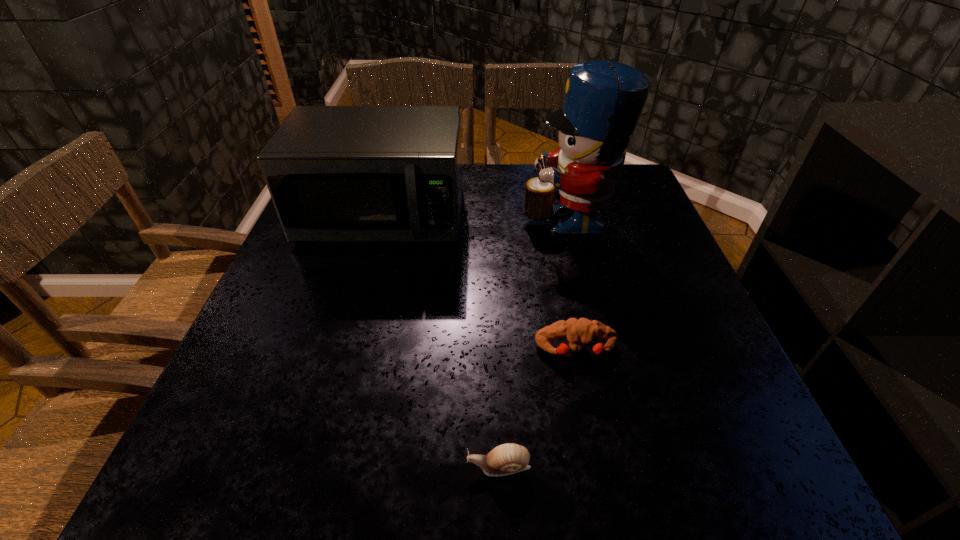
Locate an element on the screen. nutcracker is located at coordinates (603, 101).

Where is `the third shortest object`? Image resolution: width=960 pixels, height=540 pixels. the third shortest object is located at coordinates (335, 173).

The width and height of the screenshot is (960, 540). In order to click on microwave oven in this screenshot , I will do `click(335, 173)`.

Where is `the third farthest object`? The image size is (960, 540). the third farthest object is located at coordinates pos(578,332).

What are the coordinates of `the nearest object` in the screenshot? It's located at (508, 458).

I want to click on the third object from right to left, so click(x=508, y=458).

Identify the location of vacant space located 0.180m on the front-facing side of the tallest object. (451, 216).

You are a GUI agent. You are given a task and a screenshot of the screen. Output one action in this format:
    pyautogui.click(x=<x>, y=<y>)
    Task: Click on the vacant space located on the front-facing side of the tallest object
    Image resolution: width=960 pixels, height=540 pixels.
    Given the screenshot: What is the action you would take?
    pyautogui.click(x=394, y=216)

Find the location of `free spot located on the front-facing side of the tallest object`. free spot located on the front-facing side of the tallest object is located at coordinates click(x=487, y=216).

You are a GUI agent. You are given a task and a screenshot of the screen. Output one action in this format:
    pyautogui.click(x=<x>, y=<y>)
    Task: Click on the blank space located 0.180m on the front-facing side of the third shortest object
    Image resolution: width=960 pixels, height=540 pixels.
    Given the screenshot: What is the action you would take?
    pyautogui.click(x=357, y=310)